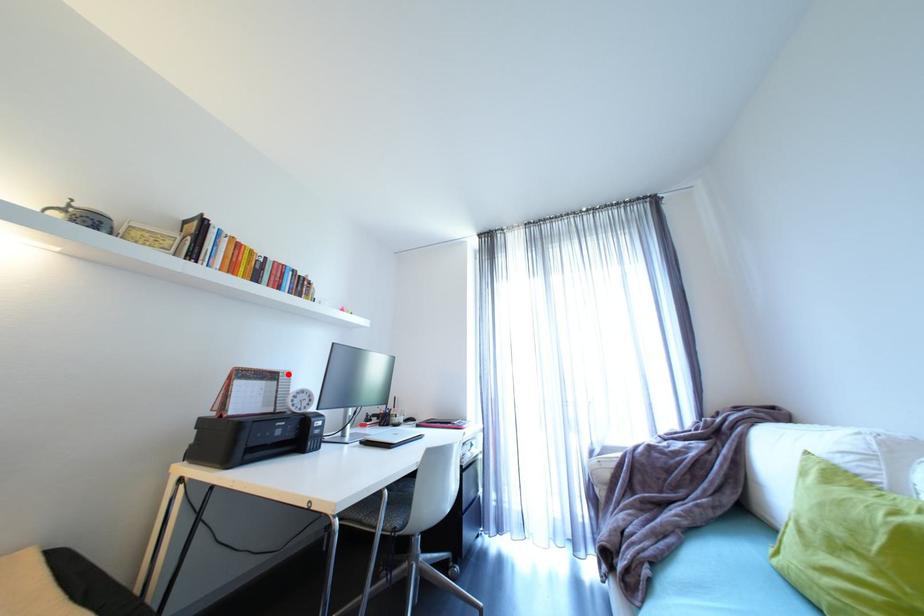
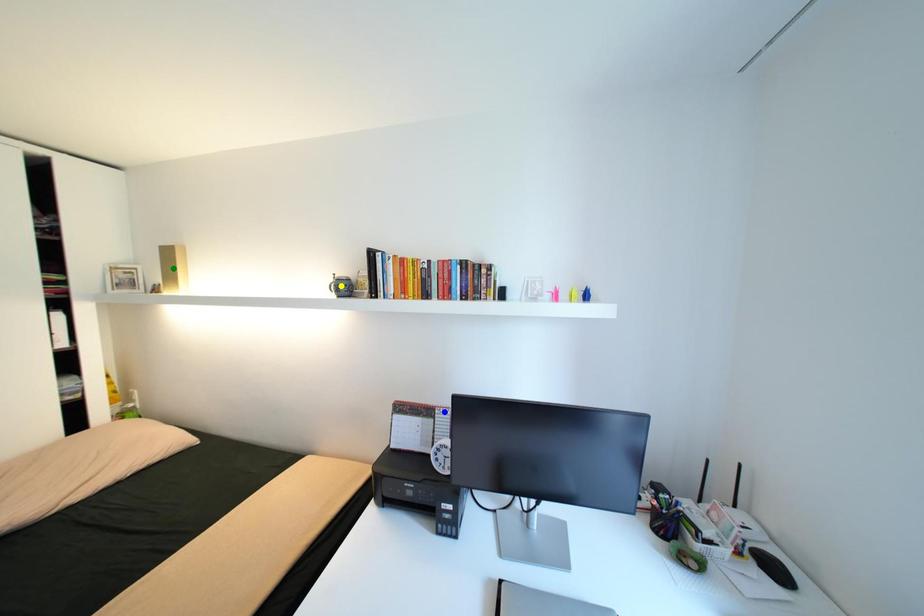
Question: I am providing you with two images of the same scene from different viewpoints. A red point is marked on the first image. You are given multiple points on the second image. Can you choose the point in image 2 that corresponds to the point in image 1?

Choices:
 (A) blue point
 (B) green point
 (C) yellow point

Answer: (A)